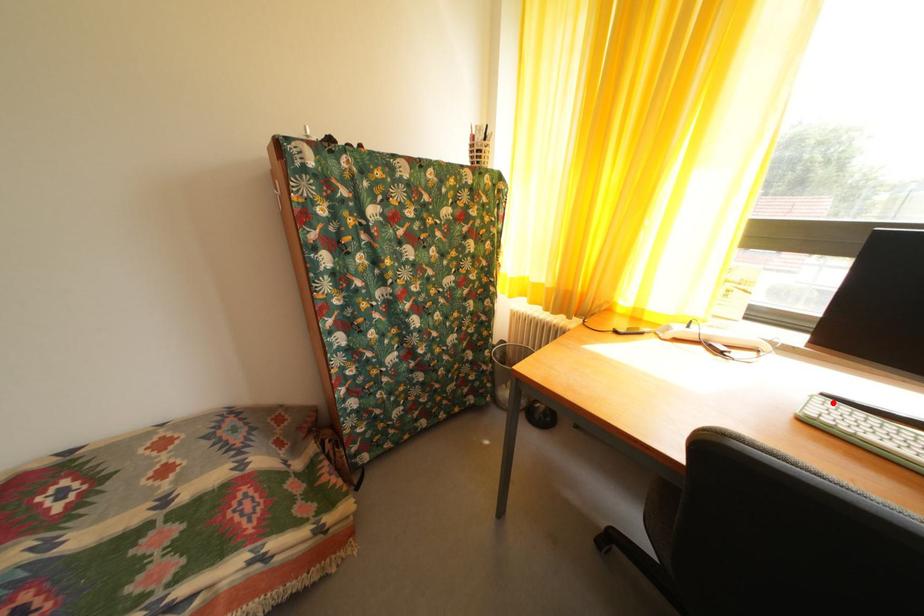
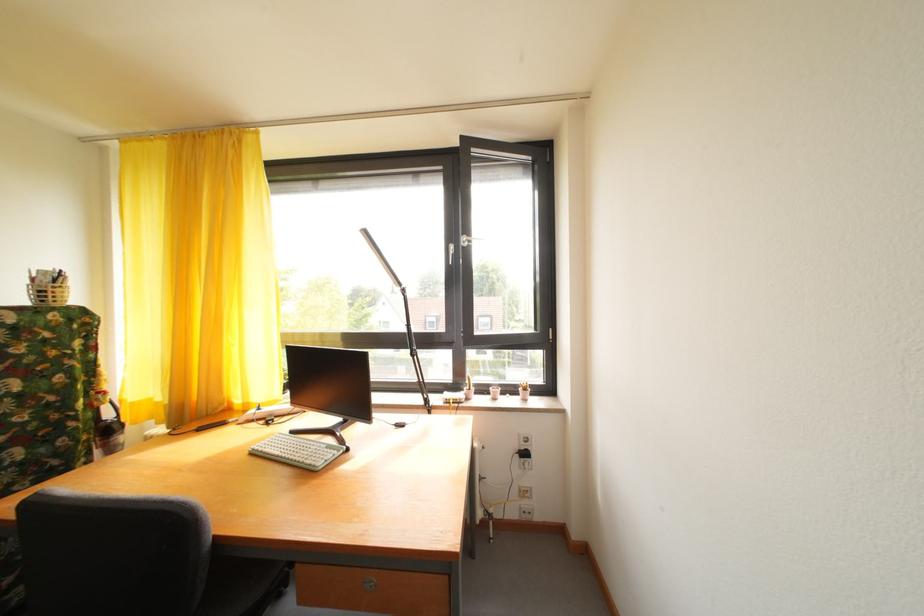
The point at the highlighted location is marked in the first image. Where is the corresponding point in the second image?

(301, 438)